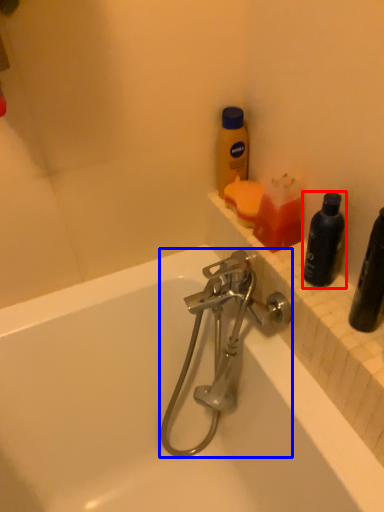
Question: Which object appears closest to the camera in this image, bottle (highlighted by a red box) or tap (highlighted by a blue box)?

Choices:
 (A) bottle
 (B) tap

Answer: (A)